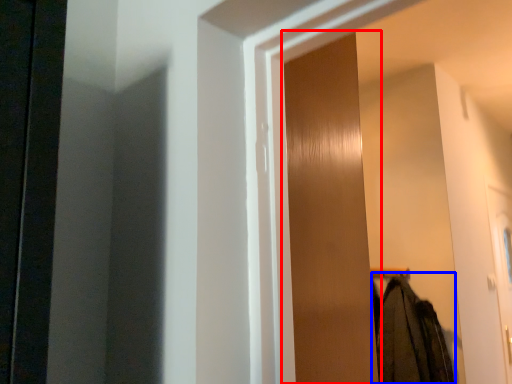
Question: Which point is further to the camera, screen door (highlighted by a red box) or clothing (highlighted by a blue box)?

Choices:
 (A) screen door
 (B) clothing

Answer: (B)